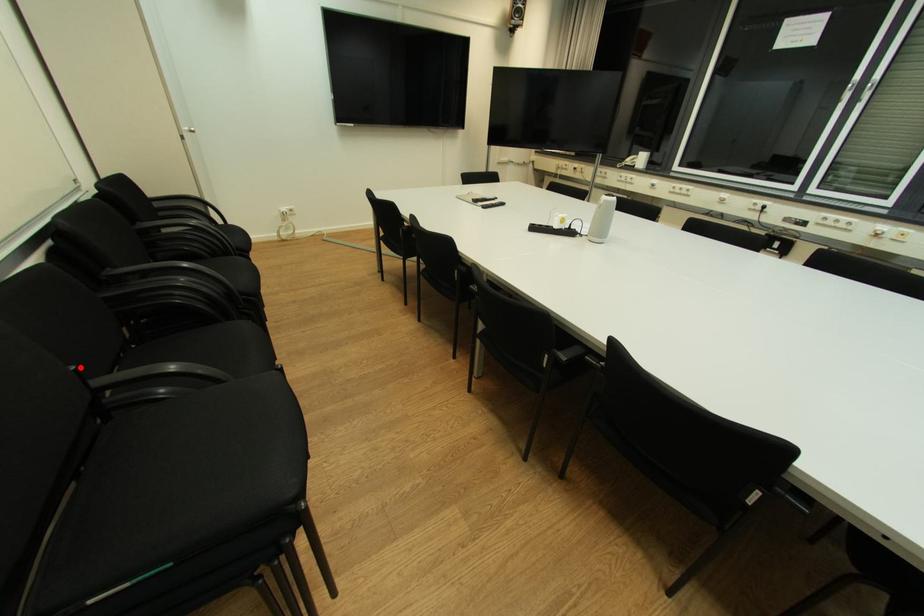
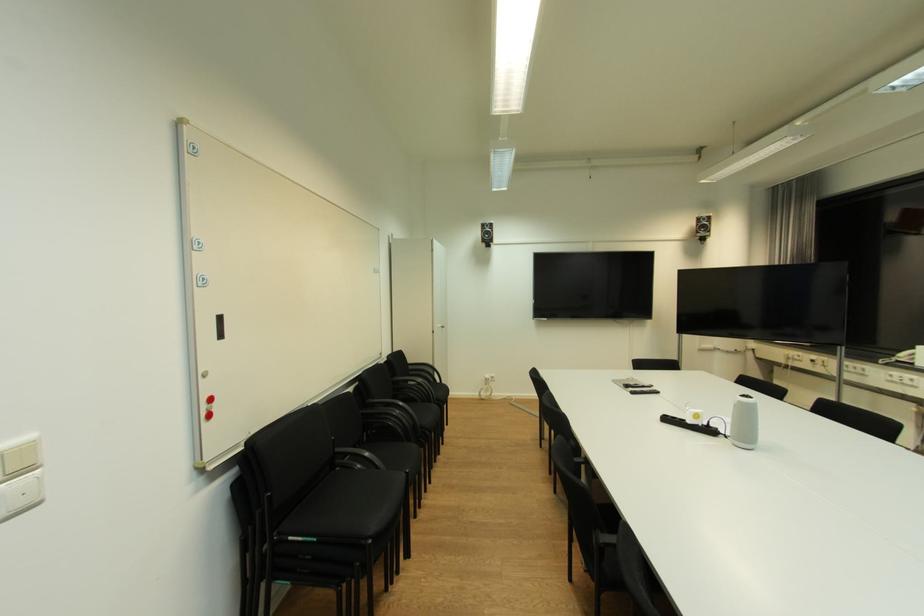
In the second image, find the point that corresponds to the highlighted location in the first image.

(338, 439)